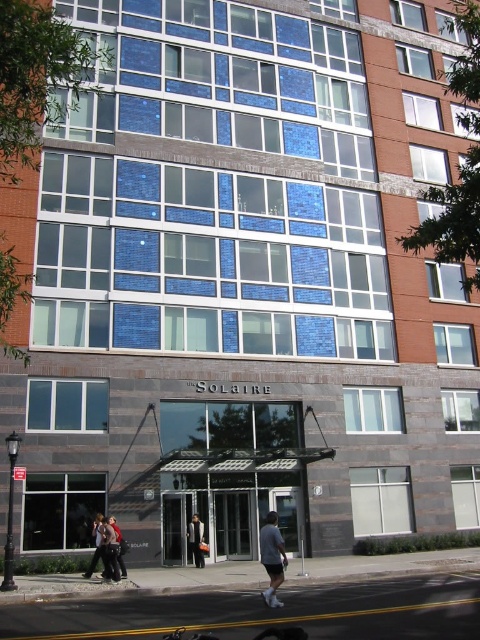
Question: Does gray asphalt at lower center have a greater width compared to dark gray pants at lower left?

Choices:
 (A) yes
 (B) no

Answer: (A)

Question: Does dark gray fabric jacket at lower center have a larger size compared to dark gray fabric jacket at center?

Choices:
 (A) no
 (B) yes

Answer: (B)

Question: Which of these objects is positioned farthest from the dark gray pants at lower left?

Choices:
 (A) dark gray fabric jacket at lower center
 (B) gray asphalt at lower center
 (C) dark gray fabric jacket at center
 (D) gray cotton shirt at center

Answer: (B)

Question: Which object is positioned farthest from the dark gray fabric jacket at center?

Choices:
 (A) dark gray pants at lower left
 (B) gray cotton shirt at center
 (C) dark gray fabric jacket at lower center

Answer: (A)

Question: Which of the following is the farthest from the observer?

Choices:
 (A) gray cotton shirt at center
 (B) gray asphalt at lower center
 (C) dark gray fabric jacket at lower center

Answer: (C)

Question: Does gray asphalt at lower center have a smaller size compared to dark gray fabric jacket at lower center?

Choices:
 (A) yes
 (B) no

Answer: (B)